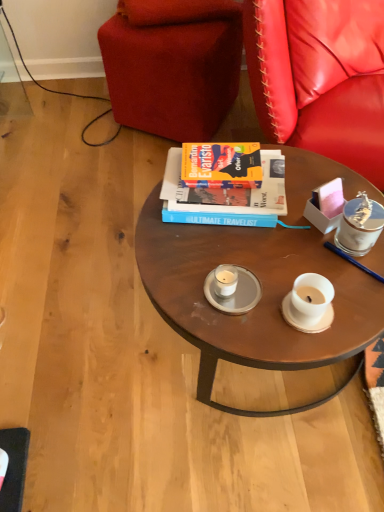
This screenshot has height=512, width=384. In order to click on vacant space that is to the left of silver metallic candle at upper right, the first coffee cup when ordered from top to bottom in this screenshot , I will do `click(292, 248)`.